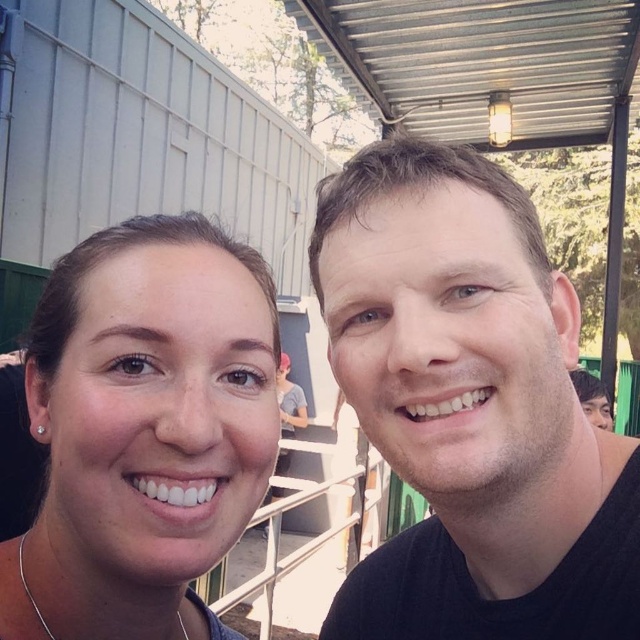
Question: Is matte skin at center wider than silver chain at lower left?

Choices:
 (A) no
 (B) yes

Answer: (B)

Question: Is the position of matte skin at center more distant than that of silver chain at lower left?

Choices:
 (A) yes
 (B) no

Answer: (B)

Question: Which object is closer to the camera taking this photo?

Choices:
 (A) silver chain at lower left
 (B) black matte shirt at right

Answer: (B)

Question: Does black matte shirt at right have a larger size compared to silver chain at lower left?

Choices:
 (A) no
 (B) yes

Answer: (B)

Question: Based on their relative distances, which object is farther from the black matte shirt at right?

Choices:
 (A) silver chain at lower left
 (B) matte skin at center

Answer: (A)

Question: Among these points, which one is farthest from the camera?

Choices:
 (A) (365, 186)
 (B) (24, 593)

Answer: (B)